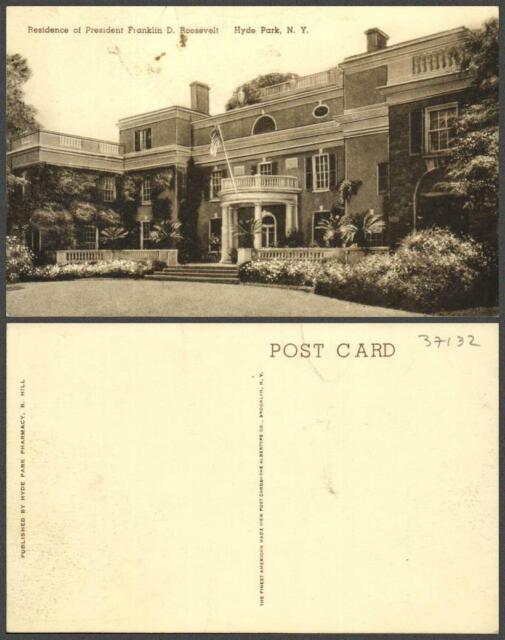
This screenshot has width=505, height=640. Identify the location of door. (266, 234).